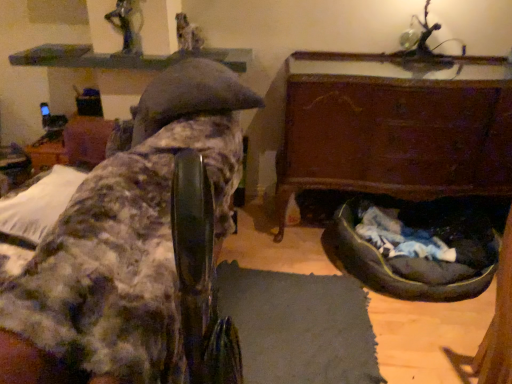
Question: Does fuzzy fabric chair at upper left, which ranks as the 1th furniture in left-to-right order, have a lesser width compared to dark gray fabric dog bed at lower right?

Choices:
 (A) no
 (B) yes

Answer: (A)

Question: Is fuzzy fabric chair at upper left, which ranks as the 1th furniture in left-to-right order, further to the viewer compared to dark gray fabric dog bed at lower right?

Choices:
 (A) no
 (B) yes

Answer: (A)

Question: Does fuzzy fabric chair at upper left, which ranks as the second furniture in right-to-left order, have a smaller size compared to dark gray fabric dog bed at lower right?

Choices:
 (A) no
 (B) yes

Answer: (A)

Question: Does fuzzy fabric chair at upper left, which ranks as the 1th furniture in left-to-right order, have a lesser height compared to dark gray fabric dog bed at lower right?

Choices:
 (A) yes
 (B) no

Answer: (B)

Question: Is fuzzy fabric chair at upper left, which ranks as the second furniture in right-to-left order, facing away from dark gray fabric dog bed at lower right?

Choices:
 (A) no
 (B) yes

Answer: (B)

Question: Do you think smooth gray statue at upper center, which is the 1th person in back-to-front order, is within dark gray fabric dog bed at lower right, or outside of it?

Choices:
 (A) outside
 (B) inside

Answer: (A)

Question: Relative to dark gray fabric dog bed at lower right, is smooth gray statue at upper center, the 1th person when ordered from right to left, in front or behind?

Choices:
 (A) front
 (B) behind

Answer: (B)

Question: Considering the positions of smooth gray statue at upper center, which is the 1th person in back-to-front order, and dark gray fabric dog bed at lower right in the image, is smooth gray statue at upper center, which is the 1th person in back-to-front order, taller or shorter than dark gray fabric dog bed at lower right?

Choices:
 (A) short
 (B) tall

Answer: (A)

Question: Does point (179, 43) appear closer or farther from the camera than point (413, 269)?

Choices:
 (A) closer
 (B) farther

Answer: (B)

Question: Is wooden chest at lower right, acting as the first furniture starting from the right, spatially inside dark gray fabric dog bed at lower right, or outside of it?

Choices:
 (A) outside
 (B) inside

Answer: (A)

Question: In the image, is wooden chest at lower right, acting as the first furniture starting from the right, on the left side or the right side of dark gray fabric dog bed at lower right?

Choices:
 (A) left
 (B) right

Answer: (A)

Question: In terms of height, does wooden chest at lower right, acting as the first furniture starting from the right, look taller or shorter compared to dark gray fabric dog bed at lower right?

Choices:
 (A) short
 (B) tall

Answer: (B)

Question: From the image's perspective, is wooden chest at lower right, the 2th furniture positioned from the left, located above or below dark gray fabric dog bed at lower right?

Choices:
 (A) above
 (B) below

Answer: (A)

Question: From a real-world perspective, relative to dark gray fabric dog bed at lower right, is metallic statue at upper center, which is counted as the 1th person, starting from the left, vertically above or below?

Choices:
 (A) above
 (B) below

Answer: (A)

Question: From the image's perspective, relative to dark gray fabric dog bed at lower right, is metallic statue at upper center, the second person when ordered from back to front, above or below?

Choices:
 (A) below
 (B) above

Answer: (B)